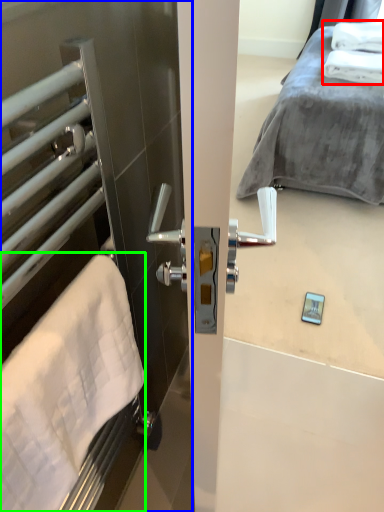
Question: Considering the real-world distances, which object is farthest from bath towel (highlighted by a red box)? screen door (highlighted by a blue box) or bath towel (highlighted by a green box)?

Choices:
 (A) screen door
 (B) bath towel

Answer: (B)